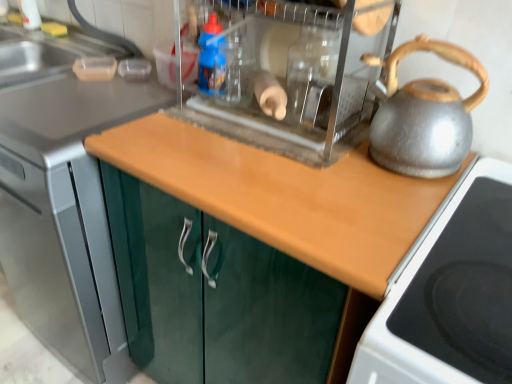
I want to click on space that is in front of blue plastic bottle at center, so click(x=195, y=128).